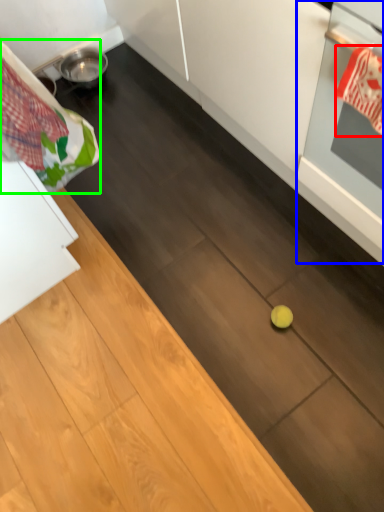
Question: Which is farther away from material (highlighted by a red box)? oven (highlighted by a blue box) or laundry (highlighted by a green box)?

Choices:
 (A) oven
 (B) laundry

Answer: (B)